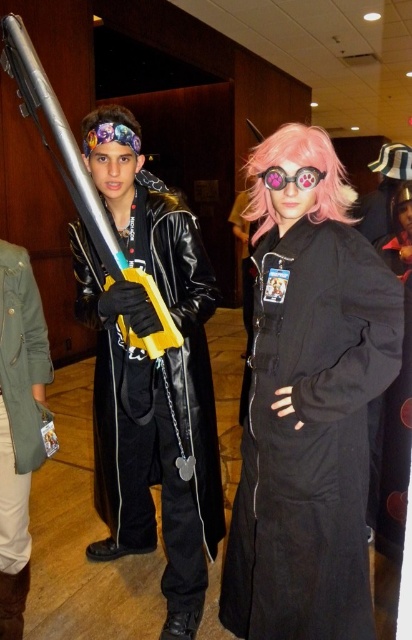
Can you confirm if pink matte/black coat at center is positioned below pink silky hair at center?

Indeed, pink matte/black coat at center is positioned under pink silky hair at center.

Is pink matte/black coat at center thinner than pink silky hair at center?

No.

Image resolution: width=412 pixels, height=640 pixels. Describe the element at coordinates (309, 404) in the screenshot. I see `pink matte/black coat at center` at that location.

Where is `pink matte/black coat at center`? This screenshot has height=640, width=412. pink matte/black coat at center is located at coordinates (309, 404).

Can you confirm if pink matte/black coat at center is taller than leather jacket at center?

No, pink matte/black coat at center is not taller than leather jacket at center.

Is pink matte/black coat at center below leather jacket at center?

Yes, pink matte/black coat at center is below leather jacket at center.

You are a GUI agent. You are given a task and a screenshot of the screen. Output one action in this format:
    pyautogui.click(x=<x>, y=<y>)
    Task: Click on the pink matte/black coat at center
    This screenshot has width=412, height=640.
    Given the screenshot: What is the action you would take?
    pyautogui.click(x=309, y=404)

Can you confirm if green matte jacket at lower left is positioned to the left of pink matte/glass goggles at center?

Yes, green matte jacket at lower left is to the left of pink matte/glass goggles at center.

Between green matte jacket at lower left and pink matte/glass goggles at center, which one has less height?

With less height is pink matte/glass goggles at center.

Who is more forward, (27, 497) or (283, 180)?

Point (283, 180)

Find the location of `green matte jacket at lower left`. green matte jacket at lower left is located at coordinates (x=18, y=424).